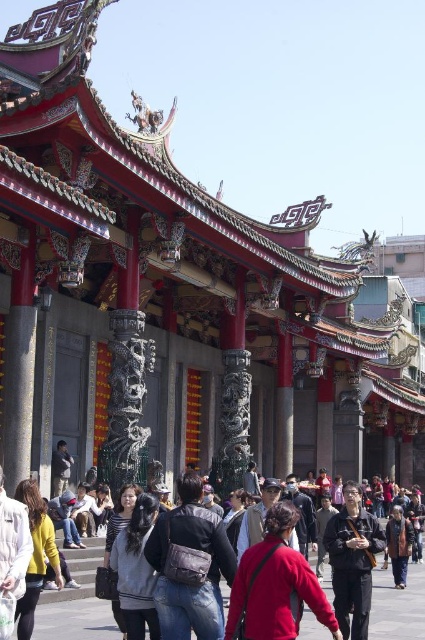
Question: Is yellow sweater at center to the right of brown textured coat at lower right from the viewer's perspective?

Choices:
 (A) no
 (B) yes

Answer: (A)

Question: Which object is farther from the camera taking this photo?

Choices:
 (A) red matte jacket at center
 (B) dark gray fabric jacket at center
 (C) dark gray hoodie at center

Answer: (B)

Question: Based on their relative distances, which object is farther from the dark gray fabric jacket at center?

Choices:
 (A) dark gray hoodie at center
 (B) brown textured coat at lower right

Answer: (B)

Question: Observing the image, what is the correct spatial positioning of red matte jacket at center in reference to leather backpack at center?

Choices:
 (A) right
 (B) left

Answer: (A)

Question: Does dark gray hoodie at center have a smaller size compared to yellow sweater at center?

Choices:
 (A) yes
 (B) no

Answer: (A)

Question: Which object is positioned farthest from the dark gray hoodie at center?

Choices:
 (A) red matte jacket at center
 (B) leather backpack at center

Answer: (A)